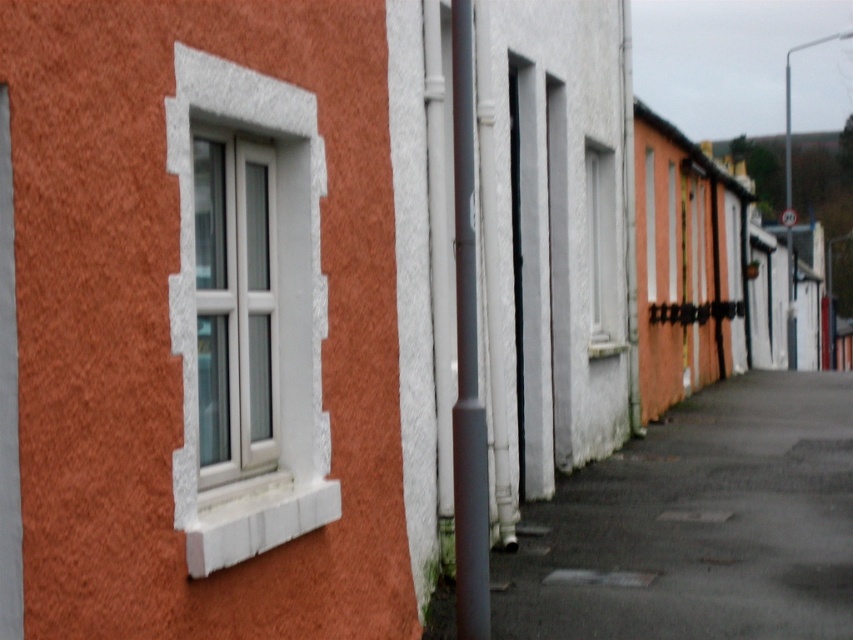
You are standing at the edge of the street looking at the row of terraced houses. Where is the dark asphalt at lower center located in terms of its 2D coordinates?

The dark asphalt at lower center is located at the 2D coordinates point (698,524).

You are a delivery person trying to park your motorcycle between the dark asphalt at lower center and the white stone window at left. Can you fit your motorcycle there if it requires 1.2 meters of space?

The dark asphalt at lower center is larger than the white stone window at left. However, without knowing the exact dimensions of the space between them, it is impossible to determine if the motorcycle will fit.

In the scene shown: You are standing on the street in front of the row of terraced houses. You notice two points marked on the buildings. One is at point (764,525) and the other at point (294,374). Which point is closer to you?

Point (294,374) is closer to you because it is less further to the camera than point (764,525).